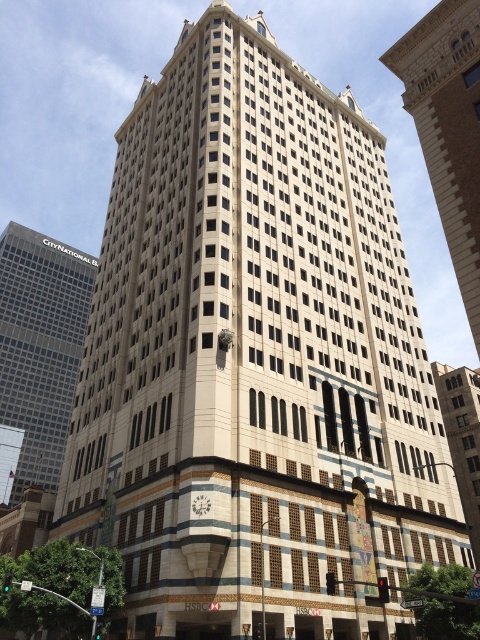
Question: Does gray glass skyscraper at left lie in front of beige stone building at center?

Choices:
 (A) yes
 (B) no

Answer: (B)

Question: Considering the real-world distances, which object is farthest from the slate gray stone building at center?

Choices:
 (A) gray glass skyscraper at left
 (B) beige stone building at center

Answer: (A)

Question: Which is farther from the slate gray stone building at center?

Choices:
 (A) beige stone building at center
 (B) gray glass skyscraper at left

Answer: (B)

Question: Does beige stone building at center have a greater width compared to slate gray stone building at center?

Choices:
 (A) no
 (B) yes

Answer: (B)

Question: Which object is farther from the camera taking this photo?

Choices:
 (A) beige stone building at center
 (B) gray glass skyscraper at left

Answer: (B)

Question: Is gray glass skyscraper at left to the left of slate gray stone building at center from the viewer's perspective?

Choices:
 (A) yes
 (B) no

Answer: (A)